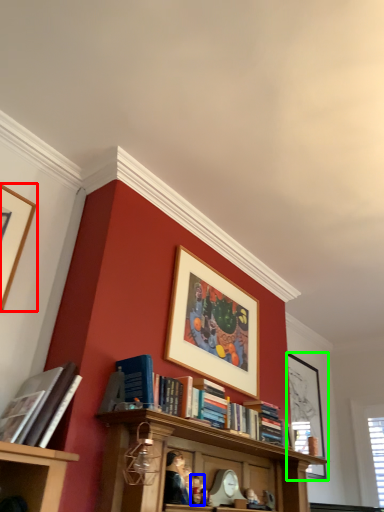
Question: Considering the real-world distances, which object is closest to picture frame (highlighted by a red box)? person (highlighted by a blue box) or picture frame (highlighted by a green box).

Choices:
 (A) person
 (B) picture frame

Answer: (A)